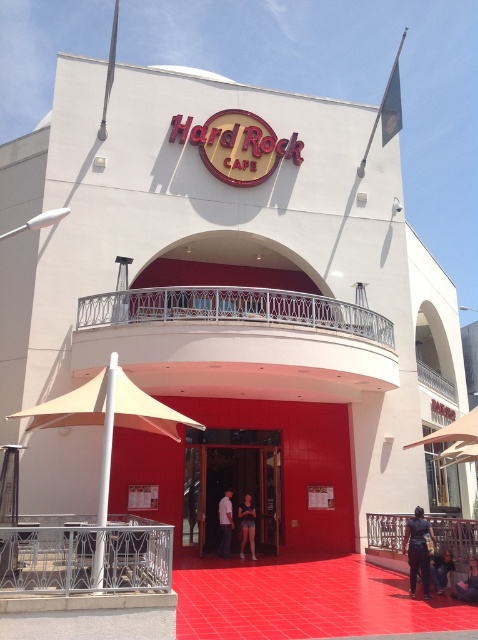
Based on the photo, can you confirm if dark blue shirt at lower right is wider than white cotton shirt at center?

Yes, dark blue shirt at lower right is wider than white cotton shirt at center.

Does point (413, 524) come farther from viewer compared to point (226, 506)?

No, it is in front of (226, 506).

Describe the element at coordinates (417, 550) in the screenshot. I see `dark blue shirt at lower right` at that location.

Where is `dark blue shirt at lower right`? The width and height of the screenshot is (478, 640). dark blue shirt at lower right is located at coordinates (417, 550).

What do you see at coordinates (231, 486) in the screenshot? I see `smooth glass door at center` at bounding box center [231, 486].

Measure the distance between smooth glass door at center and denim shorts at center.

smooth glass door at center is 11.45 meters away from denim shorts at center.

Who is more forward, (x=234, y=486) or (x=459, y=592)?

Point (x=459, y=592) is more forward.

This screenshot has width=478, height=640. In order to click on smooth glass door at center in this screenshot , I will do 231,486.

How distant is white cotton shirt at center from matte black shorts at center?

white cotton shirt at center is 52.98 centimeters from matte black shorts at center.

Based on the photo, does white cotton shirt at center have a lesser width compared to matte black shorts at center?

Indeed, white cotton shirt at center has a lesser width compared to matte black shorts at center.

The height and width of the screenshot is (640, 478). What do you see at coordinates (226, 524) in the screenshot?
I see `white cotton shirt at center` at bounding box center [226, 524].

Identify the location of white cotton shirt at center. (226, 524).